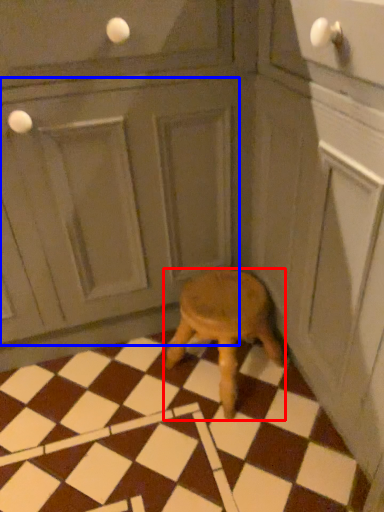
Question: Which object appears closest to the camera in this image, stool (highlighted by a red box) or screen door (highlighted by a blue box)?

Choices:
 (A) stool
 (B) screen door

Answer: (B)